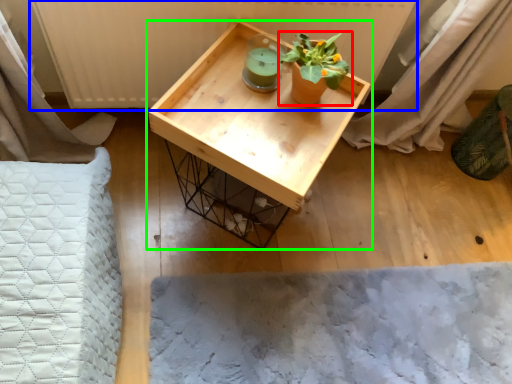
Question: Considering the real-world distances, which object is farthest from houseplant (highlighted by a red box)? radiator (highlighted by a blue box) or table (highlighted by a green box)?

Choices:
 (A) radiator
 (B) table

Answer: (A)